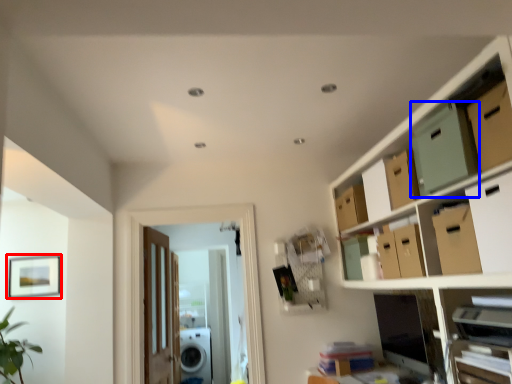
Question: Which of the following is the farthest to the observer, picture frame (highlighted by a red box) or storage box (highlighted by a blue box)?

Choices:
 (A) picture frame
 (B) storage box

Answer: (A)